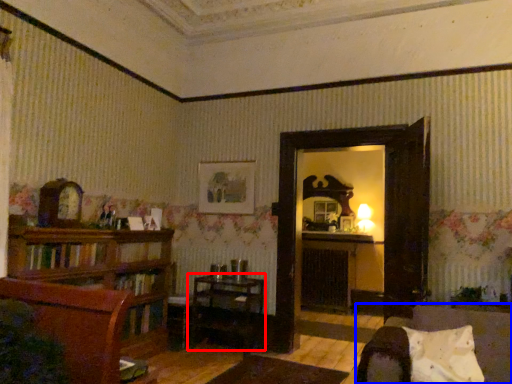
Question: Which object appears farthest to the camera in this image, table (highlighted by a red box) or chair (highlighted by a blue box)?

Choices:
 (A) table
 (B) chair

Answer: (A)